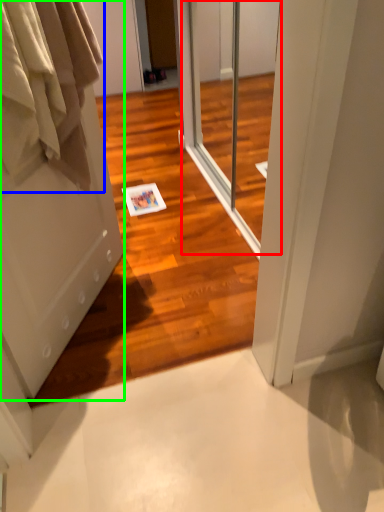
Question: Estimate the real-world distances between objects in this image. Which object is farther from screen door (highlighted by a red box), clothing (highlighted by a blue box) or door (highlighted by a green box)?

Choices:
 (A) clothing
 (B) door

Answer: (A)